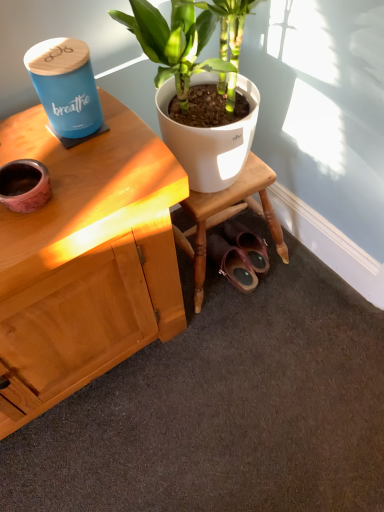
Locate an element on the screen. This screenshot has height=512, width=384. vacant point to the right of leather/matte sandals at lower center is located at coordinates (299, 272).